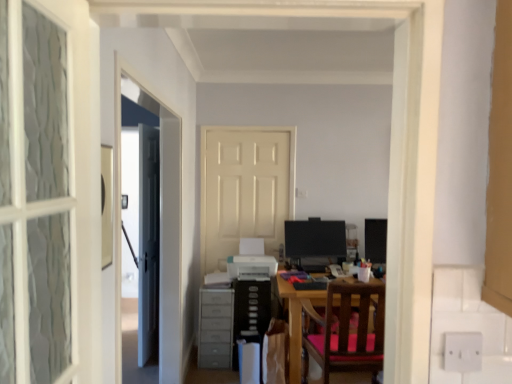
Question: From the image's perspective, is gray plastic dresser at lower left beneath matte black monitor at right, which is counted as the 1th computer monitor, starting from the right?

Choices:
 (A) yes
 (B) no

Answer: (A)

Question: Is gray plastic dresser at lower left looking in the opposite direction of matte black monitor at right, placed as the second computer monitor when sorted from left to right?

Choices:
 (A) yes
 (B) no

Answer: (B)

Question: From a real-world perspective, is gray plastic dresser at lower left on top of matte black monitor at right, which is counted as the 1th computer monitor, starting from the right?

Choices:
 (A) no
 (B) yes

Answer: (A)

Question: Is gray plastic dresser at lower left taller than matte black monitor at right, placed as the second computer monitor when sorted from left to right?

Choices:
 (A) yes
 (B) no

Answer: (A)

Question: Is there a large distance between gray plastic dresser at lower left and matte black monitor at right, placed as the second computer monitor when sorted from left to right?

Choices:
 (A) yes
 (B) no

Answer: (A)

Question: Considering the relative positions of gray plastic dresser at lower left and matte black monitor at right, placed as the second computer monitor when sorted from left to right, in the image provided, is gray plastic dresser at lower left to the right of matte black monitor at right, placed as the second computer monitor when sorted from left to right, from the viewer's perspective?

Choices:
 (A) no
 (B) yes

Answer: (A)

Question: Would you say white glossy door at center, positioned as the second door in back-to-front order, is a long distance from matte black monitor at center, arranged as the first computer monitor when viewed from the left?

Choices:
 (A) yes
 (B) no

Answer: (A)

Question: From a real-world perspective, is white glossy door at center, positioned as the 1th door in front-to-back order, physically above matte black monitor at center, arranged as the first computer monitor when viewed from the left?

Choices:
 (A) no
 (B) yes

Answer: (B)

Question: Is white glossy door at center, the 2th door from the right, not inside matte black monitor at center, placed as the 2th computer monitor when sorted from right to left?

Choices:
 (A) no
 (B) yes

Answer: (B)

Question: Considering the relative positions of white glossy door at center, positioned as the 1th door in front-to-back order, and matte black monitor at center, arranged as the first computer monitor when viewed from the left, in the image provided, is white glossy door at center, positioned as the 1th door in front-to-back order, to the left of matte black monitor at center, arranged as the first computer monitor when viewed from the left, from the viewer's perspective?

Choices:
 (A) no
 (B) yes

Answer: (B)

Question: Does white glossy door at center, the 2th door from the right, have a smaller size compared to matte black monitor at center, arranged as the first computer monitor when viewed from the left?

Choices:
 (A) yes
 (B) no

Answer: (B)

Question: Does white glossy door at center, positioned as the second door in back-to-front order, have a larger size compared to matte black monitor at center, arranged as the first computer monitor when viewed from the left?

Choices:
 (A) no
 (B) yes

Answer: (B)

Question: Is gray plastic dresser at lower left facing away from matte black monitor at center, placed as the 2th computer monitor when sorted from right to left?

Choices:
 (A) yes
 (B) no

Answer: (B)